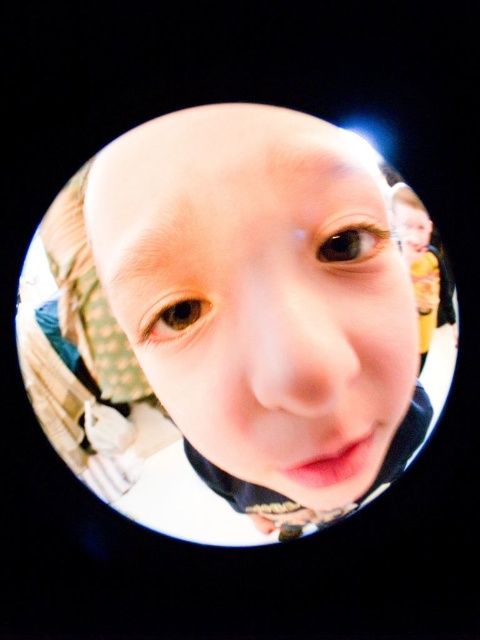
Question: Which of the following is the farthest from the observer?

Choices:
 (A) smooth skin face at center
 (B) smooth yellow shirt at right

Answer: (B)

Question: Which object appears closest to the camera in this image?

Choices:
 (A) smooth yellow shirt at right
 (B) smooth skin face at center

Answer: (B)

Question: Can you confirm if smooth skin face at center is positioned above smooth yellow shirt at right?

Choices:
 (A) yes
 (B) no

Answer: (B)

Question: Is smooth skin face at center positioned before smooth yellow shirt at right?

Choices:
 (A) no
 (B) yes

Answer: (B)

Question: Does smooth skin face at center come in front of smooth yellow shirt at right?

Choices:
 (A) yes
 (B) no

Answer: (A)